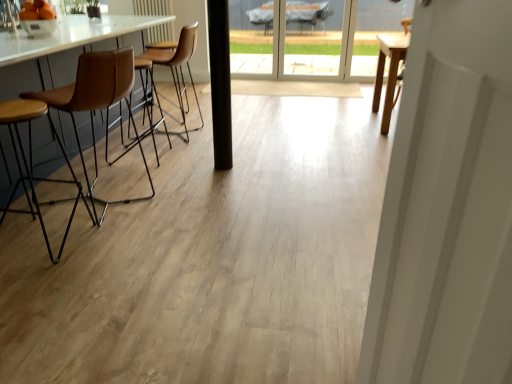
Describe the element at coordinates (97, 104) in the screenshot. The image size is (512, 384). I see `brown leather stool at left, placed as the second chair when sorted from back to front` at that location.

Where is `brown leather stool at left, placed as the second chair when sorted from back to front`? Image resolution: width=512 pixels, height=384 pixels. brown leather stool at left, placed as the second chair when sorted from back to front is located at coordinates click(97, 104).

Consider the image. Would you say brown leather chair at left, marked as the 3th chair in a front-to-back arrangement, is to the left or to the right of brown leather stool at left, placed as the second chair when sorted from back to front, in the picture?

Clearly, brown leather chair at left, marked as the 3th chair in a front-to-back arrangement, is on the right of brown leather stool at left, placed as the second chair when sorted from back to front, in the image.

From the picture: Does brown leather chair at left, marked as the 3th chair in a front-to-back arrangement, have a greater width compared to brown leather stool at left, placed as the second chair when sorted from back to front?

Yes, brown leather chair at left, marked as the 3th chair in a front-to-back arrangement, is wider than brown leather stool at left, placed as the second chair when sorted from back to front.

Considering the relative sizes of brown leather chair at left, which is the 1th chair from back to front, and brown leather stool at left, placed as the second chair when sorted from back to front, in the image provided, is brown leather chair at left, which is the 1th chair from back to front, bigger than brown leather stool at left, placed as the second chair when sorted from back to front,?

No.

Would you say brown leather chair at left, which is the 1th chair from back to front, is a long distance from brown leather stool at left, placed as the second chair when sorted from back to front?

brown leather chair at left, which is the 1th chair from back to front, is positioned a significant distance from brown leather stool at left, placed as the second chair when sorted from back to front.

Is brown leather chair at left, which is the 1th chair from back to front, positioned with its back to transparent glass screen door at upper center?

No, transparent glass screen door at upper center is not at the back of brown leather chair at left, which is the 1th chair from back to front.

Who is shorter, brown leather chair at left, marked as the 3th chair in a front-to-back arrangement, or transparent glass screen door at upper center?

With less height is brown leather chair at left, marked as the 3th chair in a front-to-back arrangement.

Identify the location of screen door above the brown leather chair at left, marked as the 3th chair in a front-to-back arrangement (from a real-world perspective). The width and height of the screenshot is (512, 384). (314, 36).

From a real-world perspective, is transparent glass screen door at upper center above or below brown leather stool at left, positioned as the first chair in front-to-back order?

From a real-world perspective, transparent glass screen door at upper center is physically above brown leather stool at left, positioned as the first chair in front-to-back order.

Considering the relative sizes of transparent glass screen door at upper center and brown leather stool at left, which ranks as the 3th chair in back-to-front order, in the image provided, is transparent glass screen door at upper center thinner than brown leather stool at left, which ranks as the 3th chair in back-to-front order,?

Yes.

Is transparent glass screen door at upper center not close to brown leather stool at left, positioned as the first chair in front-to-back order?

Yes, transparent glass screen door at upper center and brown leather stool at left, positioned as the first chair in front-to-back order, are located far from each other.

From a real-world perspective, is brown leather stool at left, which ranks as the 3th chair in back-to-front order, under transparent glass screen door at upper center?

Indeed, from a real-world perspective, brown leather stool at left, which ranks as the 3th chair in back-to-front order, is positioned beneath transparent glass screen door at upper center.

Can you tell me how much brown leather stool at left, positioned as the first chair in front-to-back order, and transparent glass screen door at upper center differ in facing direction?

They differ by 90.9 degrees in their facing directions.

Can you confirm if brown leather stool at left, which ranks as the 3th chair in back-to-front order, is thinner than transparent glass screen door at upper center?

In fact, brown leather stool at left, which ranks as the 3th chair in back-to-front order, might be wider than transparent glass screen door at upper center.

From the image's perspective, is brown leather stool at left, which ranks as the 3th chair in back-to-front order, located beneath transparent glass screen door at upper center?

Indeed, from the image's perspective, brown leather stool at left, which ranks as the 3th chair in back-to-front order, is shown beneath transparent glass screen door at upper center.

From a real-world perspective, is brown leather stool at left, positioned as the first chair in front-to-back order, beneath brown leather stool at left, placed as the second chair when sorted from back to front?

Yes, from a real-world perspective, brown leather stool at left, positioned as the first chair in front-to-back order, is below brown leather stool at left, placed as the second chair when sorted from back to front.

Considering the sizes of objects brown leather stool at left, positioned as the first chair in front-to-back order, and brown leather stool at left, positioned as the second chair in front-to-back order, in the image provided, who is bigger, brown leather stool at left, positioned as the first chair in front-to-back order, or brown leather stool at left, positioned as the second chair in front-to-back order,?

Bigger between the two is brown leather stool at left, positioned as the second chair in front-to-back order.

Is brown leather stool at left, which ranks as the 3th chair in back-to-front order, shorter than brown leather stool at left, placed as the second chair when sorted from back to front?

Yes, brown leather stool at left, which ranks as the 3th chair in back-to-front order, is shorter than brown leather stool at left, placed as the second chair when sorted from back to front.

Can you tell me how much brown leather stool at left, placed as the second chair when sorted from back to front, and brown leather stool at left, which ranks as the 3th chair in back-to-front order, differ in facing direction?

The facing directions of brown leather stool at left, placed as the second chair when sorted from back to front, and brown leather stool at left, which ranks as the 3th chair in back-to-front order, are 4.41 degrees apart.

Is brown leather stool at left, positioned as the second chair in front-to-back order, oriented towards brown leather stool at left, which ranks as the 3th chair in back-to-front order?

No, brown leather stool at left, positioned as the second chair in front-to-back order, is not turned towards brown leather stool at left, which ranks as the 3th chair in back-to-front order.

Who is smaller, brown leather stool at left, positioned as the second chair in front-to-back order, or brown leather stool at left, which ranks as the 3th chair in back-to-front order?

Smaller between the two is brown leather stool at left, which ranks as the 3th chair in back-to-front order.

Is brown leather stool at left, positioned as the first chair in front-to-back order, located within brown leather stool at left, positioned as the second chair in front-to-back order?

That's incorrect, brown leather stool at left, positioned as the first chair in front-to-back order, is not inside brown leather stool at left, positioned as the second chair in front-to-back order.

From a real-world perspective, who is located lower, brown leather stool at left, placed as the second chair when sorted from back to front, or transparent glass screen door at upper center?

brown leather stool at left, placed as the second chair when sorted from back to front, is physically lower.

From their relative heights in the image, would you say brown leather stool at left, positioned as the second chair in front-to-back order, is taller or shorter than transparent glass screen door at upper center?

In the image, brown leather stool at left, positioned as the second chair in front-to-back order, appears to be shorter than transparent glass screen door at upper center.

How many degrees apart are the facing directions of brown leather stool at left, placed as the second chair when sorted from back to front, and transparent glass screen door at upper center?

95.3 degrees.

Is brown leather stool at left, positioned as the second chair in front-to-back order, facing towards transparent glass screen door at upper center?

No, brown leather stool at left, positioned as the second chair in front-to-back order, is not aimed at transparent glass screen door at upper center.

Where is `chair above the brown leather stool at left, placed as the second chair when sorted from back to front (from a real-world perspective)`? Image resolution: width=512 pixels, height=384 pixels. chair above the brown leather stool at left, placed as the second chair when sorted from back to front (from a real-world perspective) is located at coordinates (177, 67).

You are a GUI agent. You are given a task and a screenshot of the screen. Output one action in this format:
    pyautogui.click(x=<x>, y=<y>)
    Task: Click on the screen door above the brown leather chair at left, which is the 1th chair from back to front (from the image's perspective)
    
    Given the screenshot: What is the action you would take?
    pyautogui.click(x=314, y=36)

Which object lies nearer to the anchor point transparent glass screen door at upper center, brown leather chair at left, marked as the 3th chair in a front-to-back arrangement, or brown leather stool at left, positioned as the first chair in front-to-back order?

brown leather chair at left, marked as the 3th chair in a front-to-back arrangement.

Looking at the image, which one is located closer to brown leather stool at left, which ranks as the 3th chair in back-to-front order, brown leather chair at left, which is the 1th chair from back to front, or transparent glass screen door at upper center?

The object closer to brown leather stool at left, which ranks as the 3th chair in back-to-front order, is brown leather chair at left, which is the 1th chair from back to front.

Looking at this image, considering their positions, is brown leather stool at left, positioned as the second chair in front-to-back order, positioned closer to transparent glass screen door at upper center than brown leather stool at left, which ranks as the 3th chair in back-to-front order?

brown leather stool at left, positioned as the second chair in front-to-back order, lies closer to transparent glass screen door at upper center than the other object.

Which object lies further to the anchor point brown leather chair at left, marked as the 3th chair in a front-to-back arrangement, brown leather stool at left, which ranks as the 3th chair in back-to-front order, or brown leather stool at left, placed as the second chair when sorted from back to front?

Among the two, brown leather stool at left, which ranks as the 3th chair in back-to-front order, is located further to brown leather chair at left, marked as the 3th chair in a front-to-back arrangement.

Looking at this image, when comparing their distances from brown leather stool at left, which ranks as the 3th chair in back-to-front order, does transparent glass screen door at upper center or brown leather stool at left, positioned as the second chair in front-to-back order, seem further?

transparent glass screen door at upper center lies further to brown leather stool at left, which ranks as the 3th chair in back-to-front order, than the other object.

From the image, which object appears to be nearer to transparent glass screen door at upper center, brown leather stool at left, positioned as the second chair in front-to-back order, or brown leather chair at left, which is the 1th chair from back to front?

brown leather chair at left, which is the 1th chair from back to front, is closer to transparent glass screen door at upper center.

From the image, which object appears to be nearer to brown leather stool at left, placed as the second chair when sorted from back to front, brown leather chair at left, which is the 1th chair from back to front, or transparent glass screen door at upper center?

Result: brown leather chair at left, which is the 1th chair from back to front, lies closer to brown leather stool at left, placed as the second chair when sorted from back to front, than the other object.

Estimate the real-world distances between objects in this image. Which object is further from brown leather stool at left, positioned as the second chair in front-to-back order, brown leather chair at left, marked as the 3th chair in a front-to-back arrangement, or brown leather stool at left, positioned as the first chair in front-to-back order?

The object further to brown leather stool at left, positioned as the second chair in front-to-back order, is brown leather chair at left, marked as the 3th chair in a front-to-back arrangement.

Locate an element on the screen. chair positioned between brown leather stool at left, placed as the second chair when sorted from back to front, and transparent glass screen door at upper center from near to far is located at coordinates (177, 67).

Locate an element on the screen. This screenshot has width=512, height=384. chair between brown leather stool at left, which ranks as the 3th chair in back-to-front order, and brown leather chair at left, marked as the 3th chair in a front-to-back arrangement, in the front-back direction is located at coordinates (97, 104).